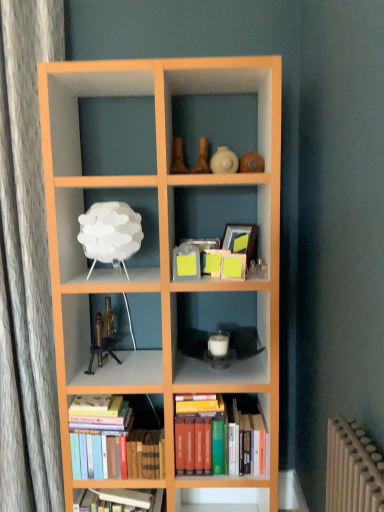
Question: From the image's perspective, is white matte lamp at upper left, arranged as the 1th shelf when viewed from the top, above or below hardcover books at bottom left, the first book positioned from the left?

Choices:
 (A) above
 (B) below

Answer: (A)

Question: From a real-world perspective, is white matte lamp at upper left, acting as the 1th shelf starting from the left, above or below hardcover books at bottom left, acting as the 2th book starting from the right?

Choices:
 (A) above
 (B) below

Answer: (A)

Question: Which is farther from the hardcover books at bottom left, acting as the 2th book starting from the right?

Choices:
 (A) brass metallic microscope at center-left
 (B) white matte candle at center, which is the first shelf from right to left
 (C) white matte lamp at upper left, acting as the 1th shelf starting from the left
 (D) hardcover books at center, arranged as the 1th book when viewed from the right

Answer: (C)

Question: Considering the real-world distances, which object is closest to the hardcover books at center, arranged as the 1th book when viewed from the right?

Choices:
 (A) white matte candle at center, the second shelf in the top-to-bottom sequence
 (B) white matte lamp at upper left, acting as the 1th shelf starting from the left
 (C) brass metallic microscope at center-left
 (D) hardcover books at bottom left, the first book positioned from the left

Answer: (A)